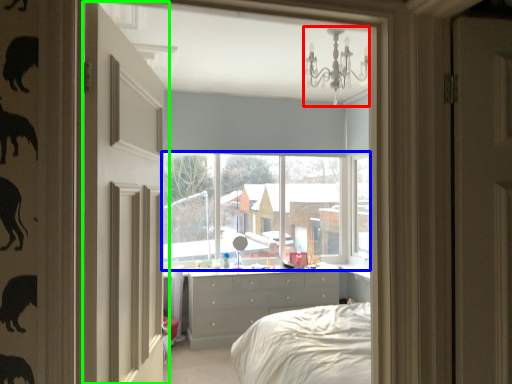
Question: Which is farther away from light fixture (highlighted by a red box)? window (highlighted by a blue box) or door (highlighted by a green box)?

Choices:
 (A) window
 (B) door

Answer: (A)